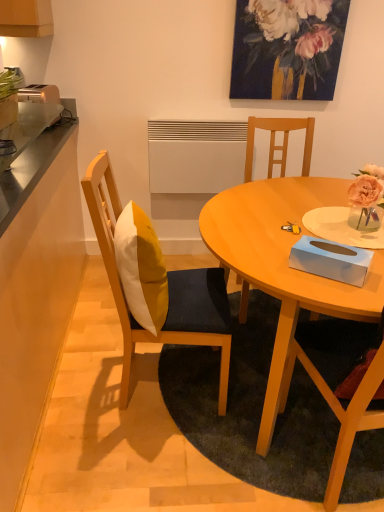
What are the coordinates of `free location in front of wooden chair with cushion at left, which is counted as the 3th chair, starting from the right` in the screenshot? It's located at (126, 458).